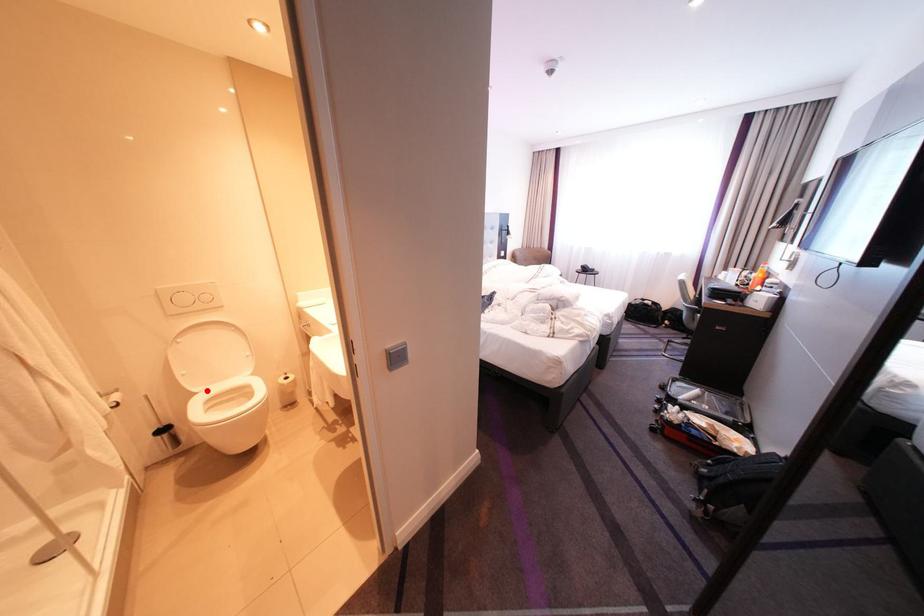
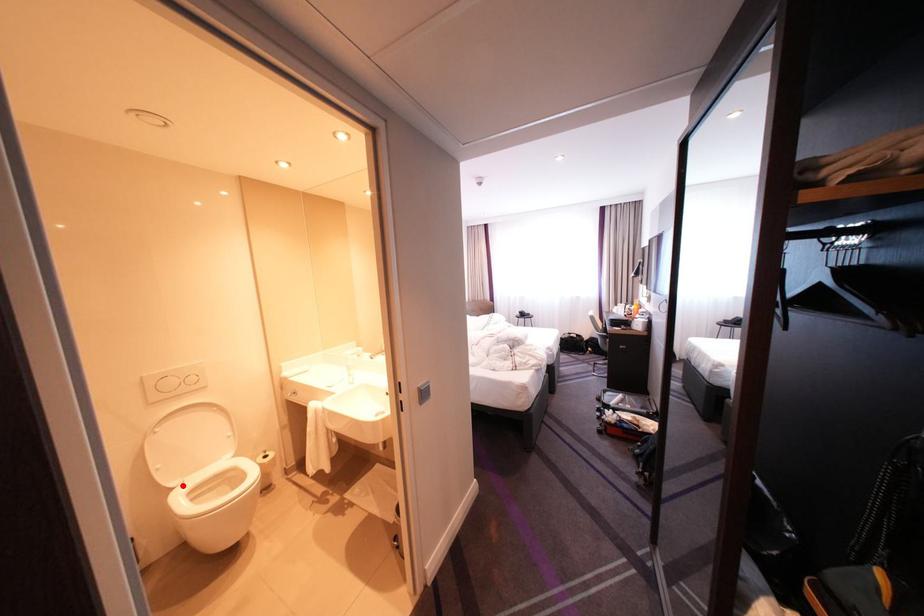
I am providing you with two images of the same scene from different viewpoints. A red point is marked on the first image and another point is marked on the second image. Is the marked point in image1 the same physical position as the marked point in image2?

Yes